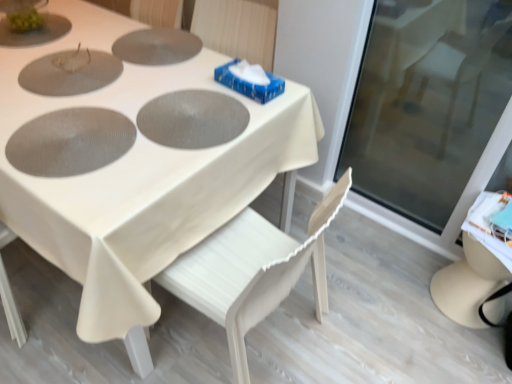
Where is `free space above matte gray pizza pan at upper center, which is the 3th pizza pan from front to back (from a real-world perspective)`? The height and width of the screenshot is (384, 512). free space above matte gray pizza pan at upper center, which is the 3th pizza pan from front to back (from a real-world perspective) is located at coordinates (149, 40).